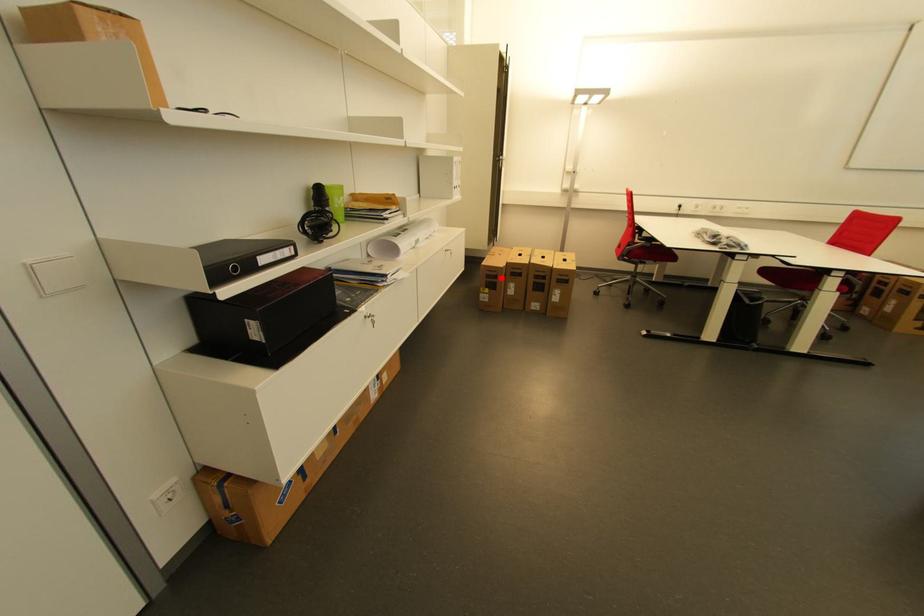
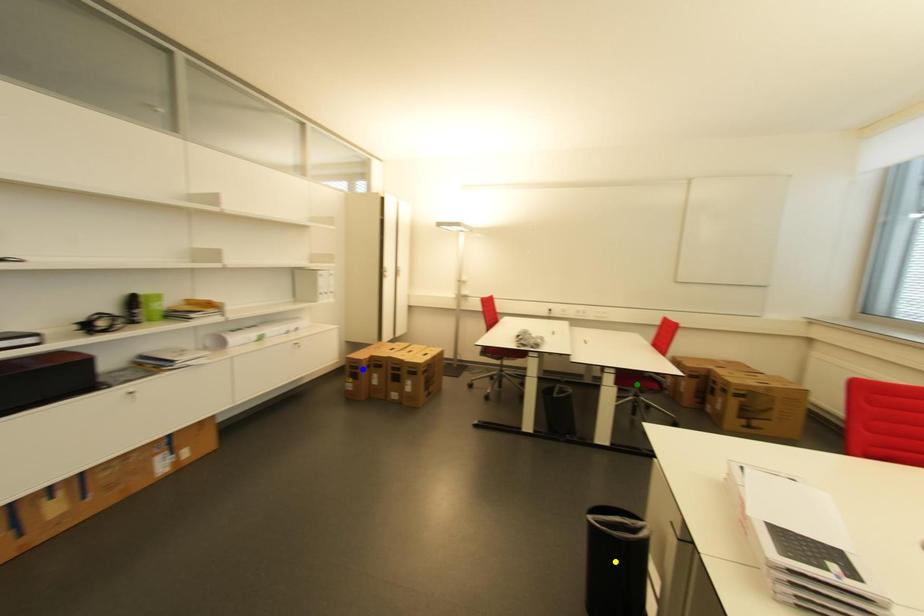
Question: I am providing you with two images of the same scene from different viewpoints. A red point is marked on the first image. You are given multiple points on the second image. Can you choose the point in image 2 that corresponds to the point in image 1?

Choices:
 (A) green point
 (B) yellow point
 (C) blue point

Answer: (C)